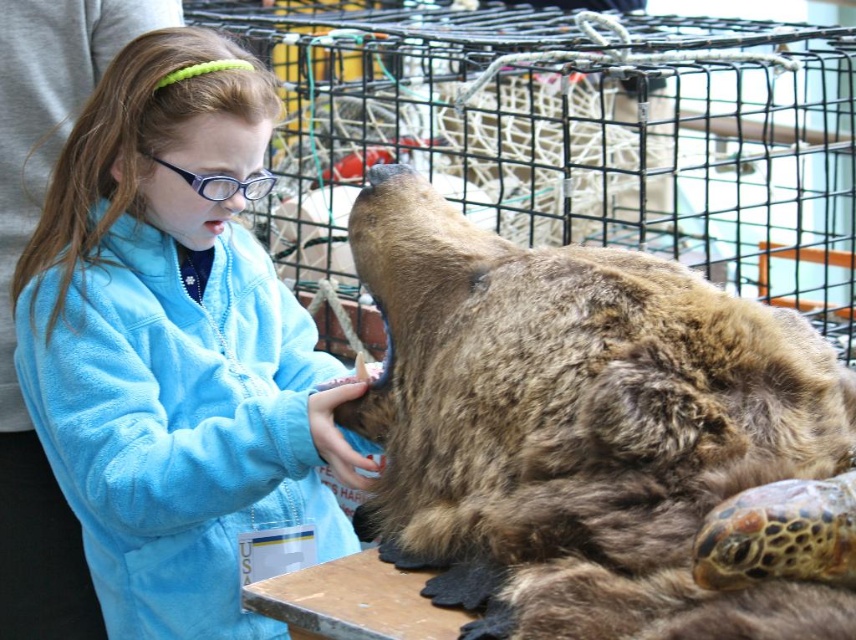
You are a photographer trying to capture the girl and the turtle in a single shot. You are positioned at point A, which is behind the turtle. To include both the girl and the turtle in your frame without any obstruction, should you move towards point B at point (631, 609) or point C at point (305, 324)?

You should move towards point B at point (631, 609) because it is in front of point C at point (305, 324), allowing you to capture both the girl and the turtle without obstruction.

You are a visitor at a marine conservation event. You see a brown furry bear at center and a blue fleece jacket at upper left. Which object is positioned to the right of the other?

The brown furry bear at center is to the right of the blue fleece jacket at upper left.

You are a visitor at a marine conservation event. You see a brown furry bear at center and a blue fleece jacket at upper left. Which object is positioned lower in the image?

The brown furry bear at center is located below the blue fleece jacket at upper left, so it is positioned lower in the image.